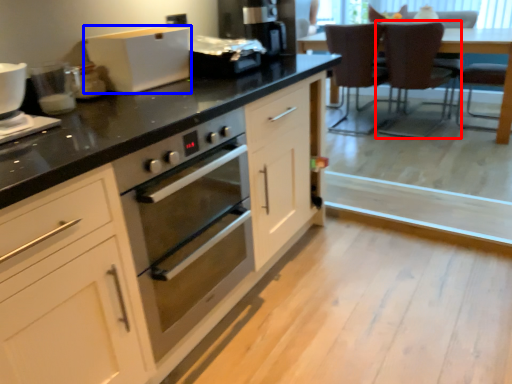
Question: Which object appears farthest to the camera in this image, chair (highlighted by a red box) or home appliance (highlighted by a blue box)?

Choices:
 (A) chair
 (B) home appliance

Answer: (A)